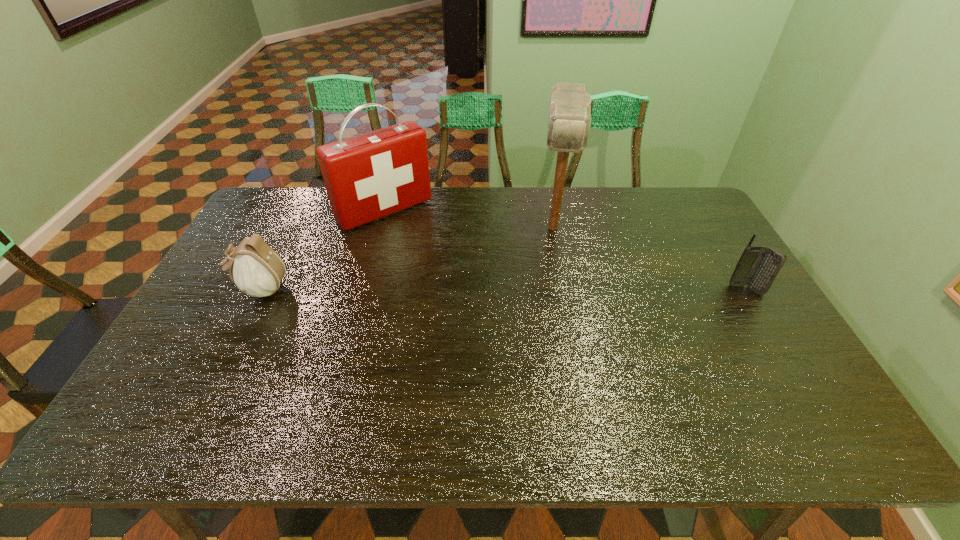
Image resolution: width=960 pixels, height=540 pixels. What are the coordinates of `the leftmost object` in the screenshot? It's located at (256, 269).

Identify the location of the rightmost object. Image resolution: width=960 pixels, height=540 pixels. (757, 267).

Identify the location of mallet. Image resolution: width=960 pixels, height=540 pixels. (569, 119).

Where is `the second object from left to right`? This screenshot has width=960, height=540. the second object from left to right is located at coordinates (369, 176).

Where is `the first-aid kit`? the first-aid kit is located at coordinates (369, 176).

This screenshot has height=540, width=960. Identify the location of vacant space located 0.070m on the front-facing side of the leftmost object. (207, 288).

Find the location of a particular element. This screenshot has height=540, width=960. vacant point located on the keyboard of the rightmost object is located at coordinates tap(763, 319).

The height and width of the screenshot is (540, 960). In order to click on vacant point located above the head of the second object from right to left in this screenshot , I will do `click(553, 285)`.

The width and height of the screenshot is (960, 540). I want to click on vacant space located 0.050m above the head of the second object from right to left, so tap(554, 261).

At what (x,y) coordinates should I click in order to perform the action: click on free location located above the head of the second object from right to left. Please return your answer as a coordinate pair (x, y). Looking at the image, I should click on (553, 267).